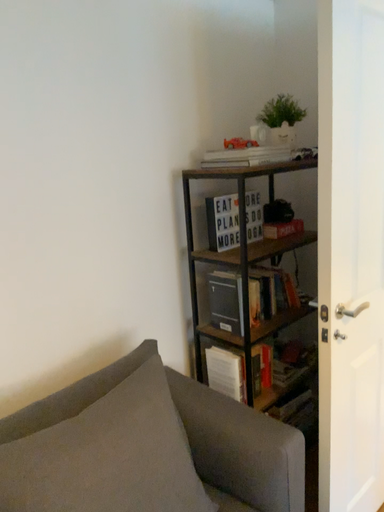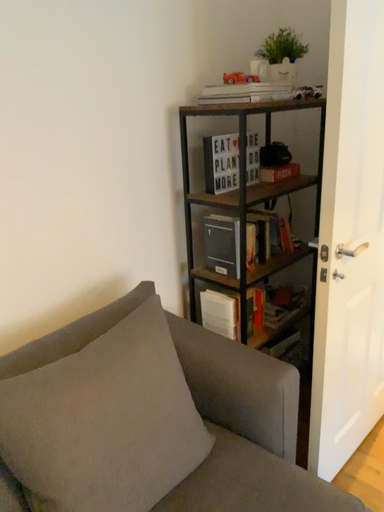
Question: How did the camera likely rotate when shooting the video?

Choices:
 (A) rotated upward
 (B) rotated downward

Answer: (B)